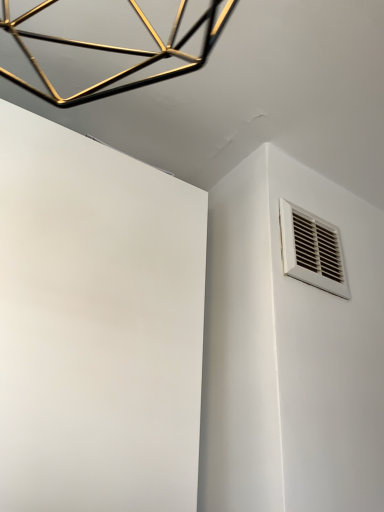
Question: Should I look upward or downward to see white plastic vent at upper right?

Choices:
 (A) up
 (B) down

Answer: (A)